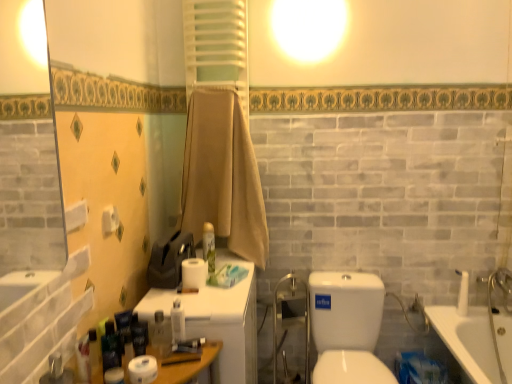
What do you see at coordinates (177, 322) in the screenshot? I see `translucent plastic bottle at center, acting as the second toiletry starting from the back` at bounding box center [177, 322].

Measure the distance between point [131,381] and camera.

They are 1.24 meters apart.

Where is `matte green spray can at center, positioned as the 5th toiletry in left-to-right order`? The image size is (512, 384). matte green spray can at center, positioned as the 5th toiletry in left-to-right order is located at coordinates (209, 246).

This screenshot has height=384, width=512. Describe the element at coordinates (114, 376) in the screenshot. I see `white matte roll of toilet paper at lower left, positioned as the first toiletry in front-to-back order` at that location.

What are the coordinates of `white matte roll of toilet paper at lower left, the 4th toiletry when ordered from right to left` in the screenshot? It's located at (114, 376).

What do you see at coordinates (217, 319) in the screenshot?
I see `white plastic medicine cabinet at center` at bounding box center [217, 319].

You are a GUI agent. You are given a task and a screenshot of the screen. Output one action in this format:
    pyautogui.click(x=<x>, y=<y>)
    Task: Click on the translucent plastic bottle at center, the 4th toiletry when ordered from front to back
    The height and width of the screenshot is (384, 512).
    Given the screenshot: What is the action you would take?
    pyautogui.click(x=177, y=322)

From the image's perspective, is white matte toilet paper at center, marked as the first toilet paper in a right-to-left arrangement, located above translucent plastic bottle at center, acting as the second toiletry starting from the back?

Yes.

Considering their positions, is white matte toilet paper at center, acting as the 2th toilet paper starting from the left, located in front of or behind translucent plastic bottle at center, the 4th toiletry when ordered from front to back?

Clearly, white matte toilet paper at center, acting as the 2th toilet paper starting from the left, is behind translucent plastic bottle at center, the 4th toiletry when ordered from front to back.

Is point (197, 266) in front of point (179, 330)?

That is False.

Where is `the 1st toiletry to the left of the white matte toilet paper at center, which is the 2th toilet paper in front-to-back order, starting your count from the anchor`? the 1st toiletry to the left of the white matte toilet paper at center, which is the 2th toilet paper in front-to-back order, starting your count from the anchor is located at coordinates (177, 322).

Is beige cotton towel at center thinner than white plastic medicine cabinet at center?

Yes, beige cotton towel at center is thinner than white plastic medicine cabinet at center.

There is a white plastic medicine cabinet at center. What are the coordinates of `bath towel above it (from a real-world perspective)` in the screenshot? It's located at (222, 176).

Is beige cotton towel at center in contact with white plastic medicine cabinet at center?

No, beige cotton towel at center is not making contact with white plastic medicine cabinet at center.

Is beige cotton towel at center not within white plastic medicine cabinet at center?

That's correct, beige cotton towel at center is outside of white plastic medicine cabinet at center.

From a real-world perspective, is clear glass mirror at left physically below white matte toilet paper at lower left, which is the first toilet paper from left to right?

No.

From the image's perspective, count 2nd toilet papers downward from the clear glass mirror at left and point to it. Please provide its 2D coordinates.

[(143, 369)]

Is clear glass mirror at left not close to white matte toilet paper at lower left, the first toilet paper positioned from the front?

Yes, clear glass mirror at left and white matte toilet paper at lower left, the first toilet paper positioned from the front, are located far from each other.

From a real-world perspective, is white plastic medicine cabinet at center on matte black tube at lower left, marked as the 3th toiletry in a front-to-back arrangement?

No, from a real-world perspective, white plastic medicine cabinet at center is not over matte black tube at lower left, marked as the 3th toiletry in a front-to-back arrangement

Can you confirm if white plastic medicine cabinet at center is positioned to the left of matte black tube at lower left, the third toiletry when ordered from right to left?

In fact, white plastic medicine cabinet at center is to the right of matte black tube at lower left, the third toiletry when ordered from right to left.

Can you see white plastic medicine cabinet at center touching matte black tube at lower left, the 3th toiletry positioned from the back?

No, white plastic medicine cabinet at center is not with matte black tube at lower left, the 3th toiletry positioned from the back.

Looking at this image, is white plastic medicine cabinet at center aimed at matte black tube at lower left, which is counted as the third toiletry, starting from the left?

No.

Is translucent plastic bottle at center, the second toiletry in the right-to-left sequence, turned away from transparent glass shower door at center?

No.

From the picture: From the image's perspective, which one is positioned lower, translucent plastic bottle at center, acting as the second toiletry starting from the back, or transparent glass shower door at center?

transparent glass shower door at center.

From a real-world perspective, is translucent plastic bottle at center, which is counted as the fourth toiletry, starting from the left, physically below transparent glass shower door at center?

Incorrect, from a real-world perspective, translucent plastic bottle at center, which is counted as the fourth toiletry, starting from the left, is higher than transparent glass shower door at center.

Looking at their sizes, would you say clear glass mirror at left is wider or thinner than matte green spray can at center, positioned as the 5th toiletry in left-to-right order?

In the image, clear glass mirror at left appears to be wider than matte green spray can at center, positioned as the 5th toiletry in left-to-right order.

Is clear glass mirror at left at the left side of matte green spray can at center, which is the fifth toiletry in front-to-back order?

Yes, clear glass mirror at left is to the left of matte green spray can at center, which is the fifth toiletry in front-to-back order.

The height and width of the screenshot is (384, 512). I want to click on the 4th toiletry counting from the right of the clear glass mirror at left, so click(209, 246).

Is clear glass mirror at left positioned beyond the bounds of white plastic medicine cabinet at center?

Yes, clear glass mirror at left is located beyond the bounds of white plastic medicine cabinet at center.

Between point (23, 90) and point (223, 316), which one is positioned in front?

Point (223, 316)

You are a GUI agent. You are given a task and a screenshot of the screen. Output one action in this format:
    pyautogui.click(x=<x>, y=<y>)
    Task: Click on the 1st toiletry in front of the white matte toilet paper at center, which is the 2th toilet paper in front-to-back order, counting from the anchor's position
    
    Given the screenshot: What is the action you would take?
    pyautogui.click(x=177, y=322)

Locate an element on the screen. bath towel lying on the right of white plastic medicine cabinet at center is located at coordinates (222, 176).

Which object lies nearer to the anchor point white plastic medicine cabinet at center, white matte roll of toilet paper at lower left, the second toiletry in the left-to-right sequence, or transparent glass shower door at center?

transparent glass shower door at center is closer to white plastic medicine cabinet at center.

When comparing their distances from matte black tube at lower left, the 3th toiletry positioned from the back, does translucent plastic tube at lower left, placed as the 2th toiletry when sorted from front to back, or white plastic medicine cabinet at center seem further?

white plastic medicine cabinet at center lies further to matte black tube at lower left, the 3th toiletry positioned from the back, than the other object.

From the picture: Considering their positions, is white matte toilet paper at center, the 1th toilet paper positioned from the top, positioned closer to white matte roll of toilet paper at lower left, positioned as the first toiletry in front-to-back order, than clear glass mirror at left?

white matte toilet paper at center, the 1th toilet paper positioned from the top, lies closer to white matte roll of toilet paper at lower left, positioned as the first toiletry in front-to-back order, than the other object.

From the image, which object appears to be nearer to clear glass mirror at left, white plastic medicine cabinet at center or matte black tube at lower left, which is counted as the third toiletry, starting from the left?

Among the two, white plastic medicine cabinet at center is located nearer to clear glass mirror at left.

Considering their positions, is beige cotton towel at center positioned closer to matte black tube at lower left, the 3th toiletry positioned from the back, than clear glass mirror at left?

beige cotton towel at center.

Looking at the image, which one is located closer to white plastic medicine cabinet at center, white matte toilet paper at center, the first toilet paper in the back-to-front sequence, or white matte roll of toilet paper at lower left, the second toiletry in the left-to-right sequence?

The object closer to white plastic medicine cabinet at center is white matte toilet paper at center, the first toilet paper in the back-to-front sequence.

Based on their spatial positions, is clear glass mirror at left or beige cotton towel at center further from translucent plastic bottle at center, the second toiletry in the right-to-left sequence?

The object further to translucent plastic bottle at center, the second toiletry in the right-to-left sequence, is clear glass mirror at left.

Looking at the image, which one is located closer to clear glass mirror at left, transparent glass shower door at center or beige cotton towel at center?

The object closer to clear glass mirror at left is beige cotton towel at center.

The image size is (512, 384). Find the location of `toiletry between white matte roll of toilet paper at lower left, the 5th toiletry viewed from the back, and matte black tube at lower left, the third toiletry when ordered from right to left, from front to back`. toiletry between white matte roll of toilet paper at lower left, the 5th toiletry viewed from the back, and matte black tube at lower left, the third toiletry when ordered from right to left, from front to back is located at coordinates (83, 359).

Where is `toilet paper between translucent plastic tube at lower left, arranged as the 4th toiletry when viewed from the back, and matte black tube at lower left, marked as the 3th toiletry in a front-to-back arrangement, in the front-back direction`? toilet paper between translucent plastic tube at lower left, arranged as the 4th toiletry when viewed from the back, and matte black tube at lower left, marked as the 3th toiletry in a front-to-back arrangement, in the front-back direction is located at coordinates (143, 369).

Locate an element on the screen. Image resolution: width=512 pixels, height=384 pixels. medicine cabinet located between white matte roll of toilet paper at lower left, positioned as the first toiletry in front-to-back order, and transparent glass shower door at center in the depth direction is located at coordinates (217, 319).

This screenshot has width=512, height=384. I want to click on medicine cabinet between white matte roll of toilet paper at lower left, the second toiletry in the left-to-right sequence, and matte green spray can at center, which is the fifth toiletry in front-to-back order, in the front-back direction, so click(x=217, y=319).